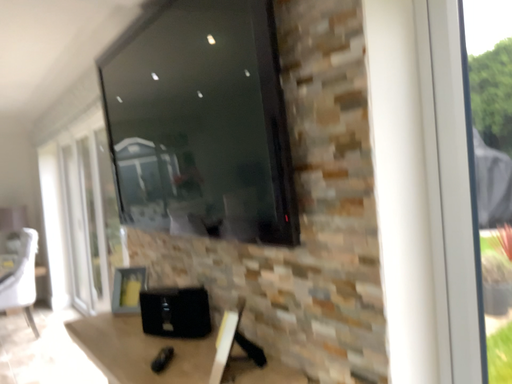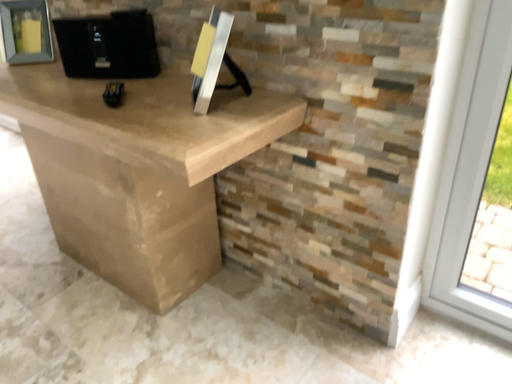
Question: How did the camera likely rotate when shooting the video?

Choices:
 (A) rotated left
 (B) rotated right

Answer: (B)